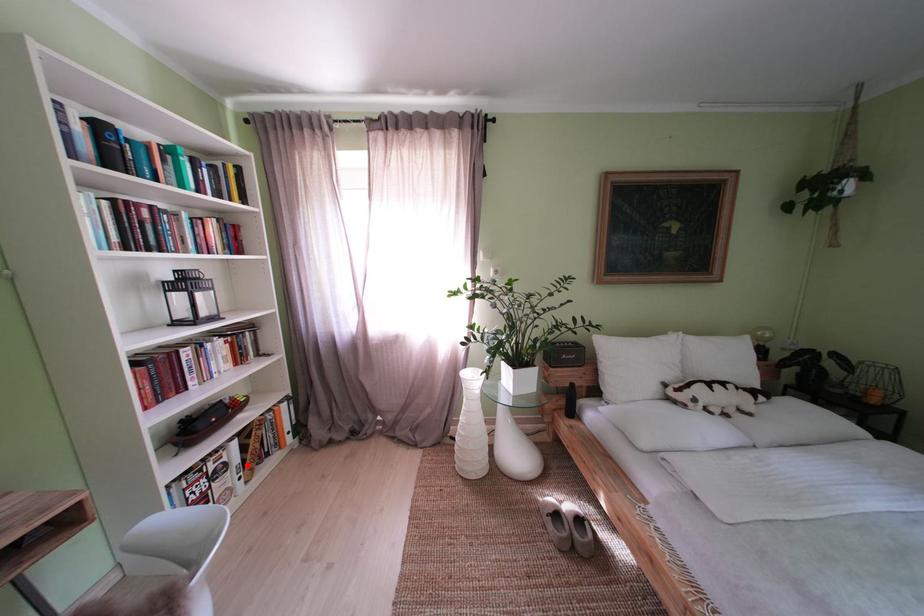
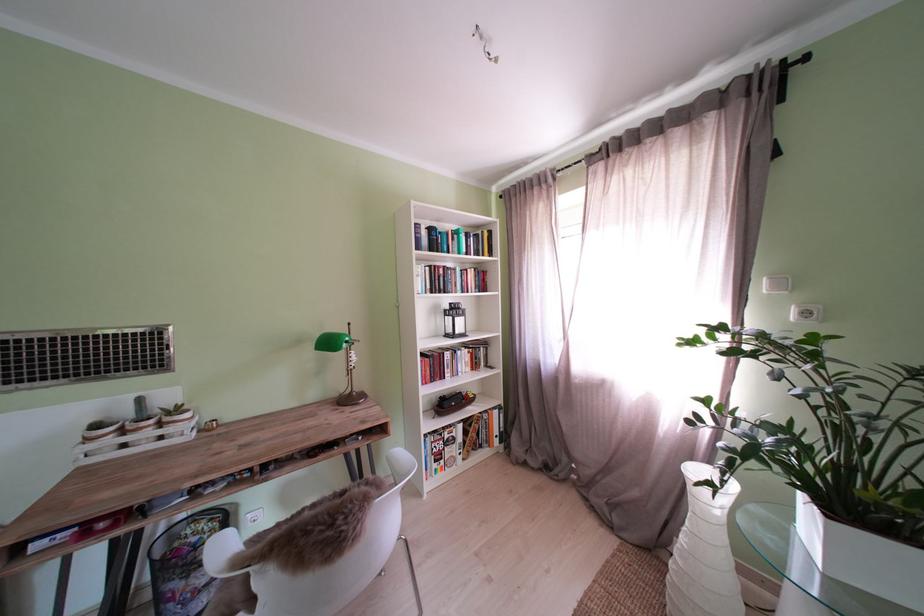
Question: I am providing you with two images of the same scene from different viewpoints. A red point is shown in image1. For the corresponding object point in image2, is it positioned nearer or farther from the camera?

Choices:
 (A) Nearer
 (B) Farther

Answer: (B)